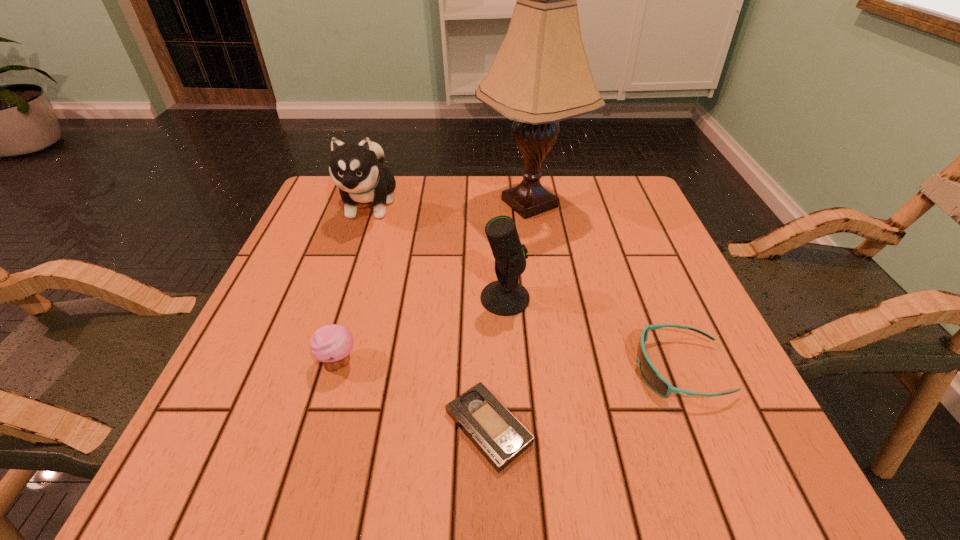
This screenshot has height=540, width=960. Identify the location of vacant space that satisfies the following two spatial constraints: 1. at the face of the shortest object; 2. on the left side of the puppy. (294, 428).

Where is `blank space that satisfies the following two spatial constraints: 1. at the face of the puppy; 2. on the right side of the third shortest object`? The height and width of the screenshot is (540, 960). blank space that satisfies the following two spatial constraints: 1. at the face of the puppy; 2. on the right side of the third shortest object is located at coordinates (316, 362).

Locate an element on the screen. The height and width of the screenshot is (540, 960). blank space that satisfies the following two spatial constraints: 1. at the face of the shortest object; 2. on the left side of the puppy is located at coordinates (294, 428).

The image size is (960, 540). In order to click on vacant space that satisfies the following two spatial constraints: 1. at the face of the microphone; 2. on the left side of the puppy in this screenshot , I will do `click(338, 298)`.